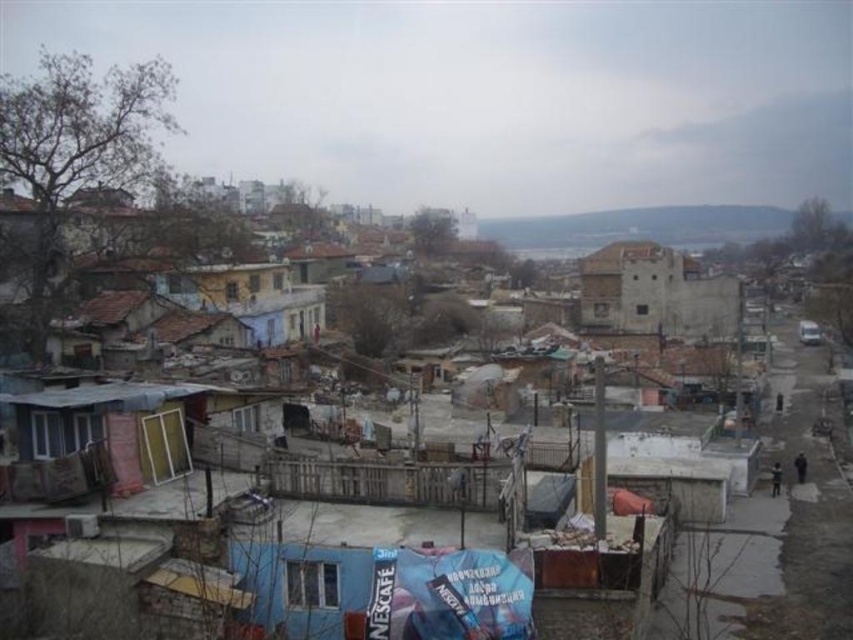
You are standing at the Nescafe advertisement banner and want to reach the point at the bottom right corner of the image. Which of the two points, point at [120,422] or point at [633,257], is closer to your current position?

Point at [120,422] is closer to the Nescafe advertisement banner as it is positioned in front of the other point at [633,257], meaning it is nearer in the observer perspective.

You are a city planner assessing the urban area. You need to determine which structure is narrower between the wooden planks hut at lower left and the weathered stone building at center. Which one is narrower?

A: The wooden planks hut at lower left is narrower than the weathered stone building at center.